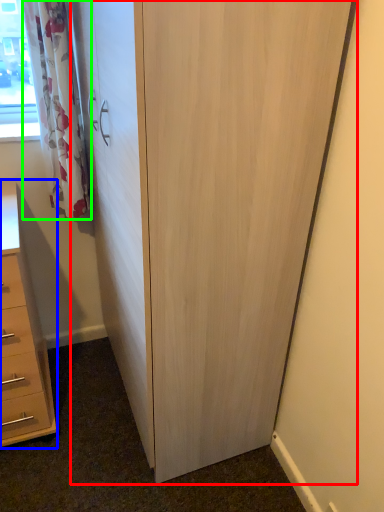
Question: Which object is positioned closest to cupboard (highlighted by a red box)? Select from chest of drawers (highlighted by a blue box) and curtain (highlighted by a green box).

Choices:
 (A) chest of drawers
 (B) curtain

Answer: (B)